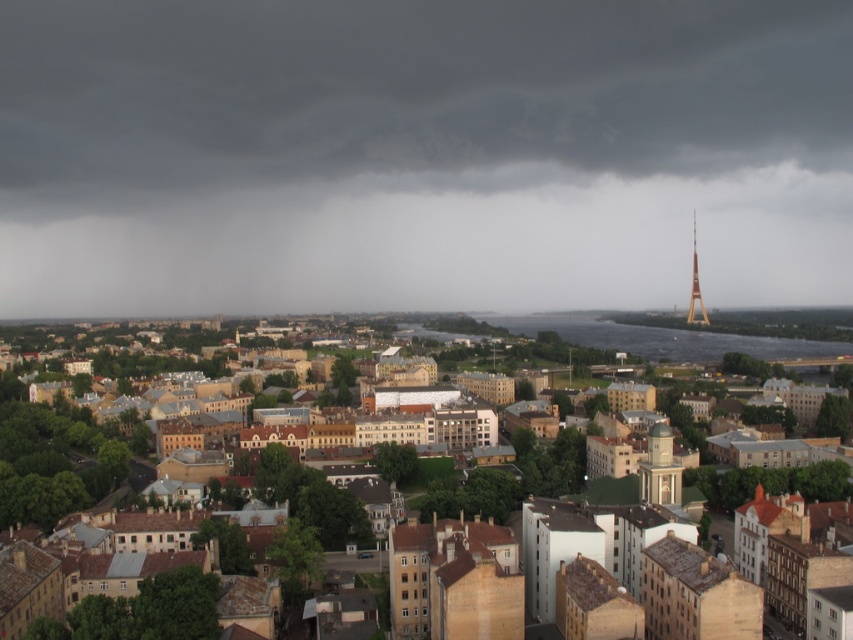
In the scene shown: You are an architect observing the cityscape. You notice the dark gray cloud at upper center and the brown textured buildings at center. Which object is located above the other?

The dark gray cloud at upper center is positioned over brown textured buildings at center, meaning it is above them.

You are an urban planner analyzing the cityscape. You notice a point marked at coordinates (x=421, y=156). What does this point indicate in the scene?

The point at coordinates (x=421, y=156) marks a dark gray cloud at upper center in the scene.

You are a city planner reviewing this urban layout. You notice the dark gray cloud at upper center and the white marble clock tower at center. Which object is positioned higher in the sky?

The dark gray cloud at upper center is positioned higher in the sky than the white marble clock tower at center because it is above it.